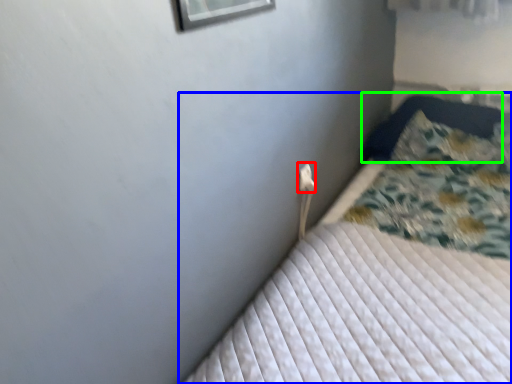
Question: Based on their relative distances, which object is nearer to electric outlet (highlighted by a red box)? Choose from bed (highlighted by a blue box) and pillow (highlighted by a green box).

Choices:
 (A) bed
 (B) pillow

Answer: (A)